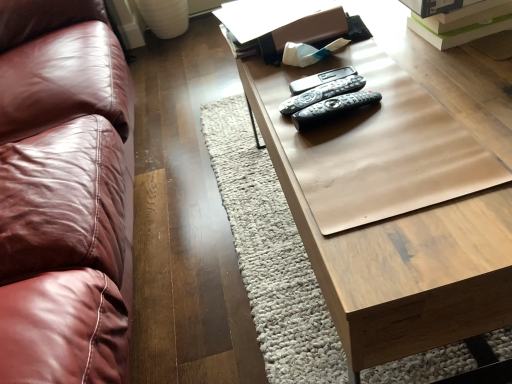
Locate an element on the screen. free space above wooden table at center (from a real-world perspective) is located at coordinates (399, 96).